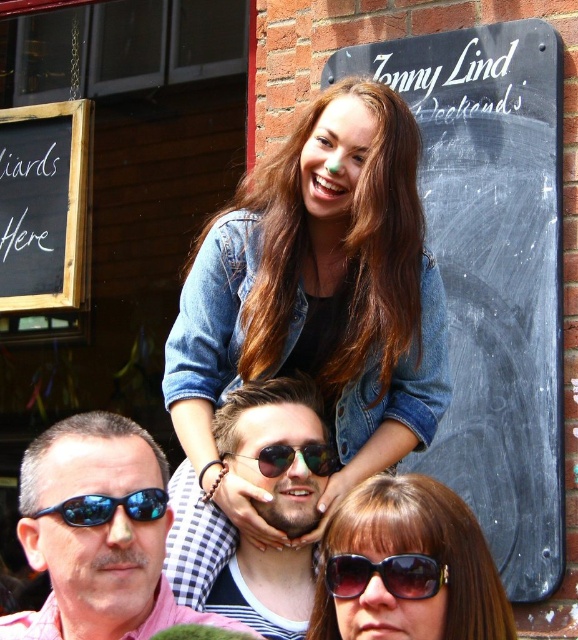
Is point (414, 132) less distant than point (335, 552)?

No.

I want to click on denim jacket at center, so click(317, 296).

This screenshot has height=640, width=578. In order to click on denim jacket at center in this screenshot , I will do `click(317, 296)`.

Which is above, pink checkered shirt at center or shiny metallic sunglasses at center?

shiny metallic sunglasses at center

Locate an element on the screen. pink checkered shirt at center is located at coordinates (98, 532).

Where is `pink checkered shirt at center`? pink checkered shirt at center is located at coordinates (98, 532).

Does point (464, 545) lie behind point (323, 444)?

That is False.

Which is more to the right, matte black sunglasses at lower center or shiny silver sunglasses at center?

Positioned to the right is matte black sunglasses at lower center.

Find the location of a particular element. The width and height of the screenshot is (578, 640). matte black sunglasses at lower center is located at coordinates (406, 566).